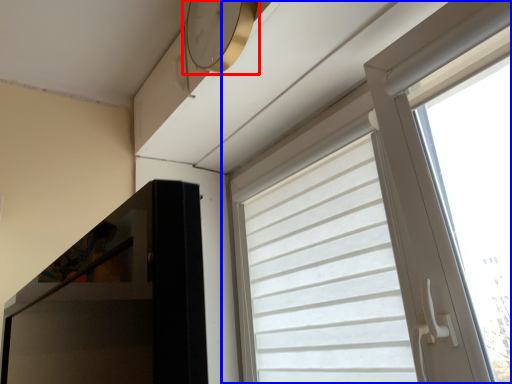
Question: Which object is further to the camera taking this photo, clock (highlighted by a red box) or window (highlighted by a blue box)?

Choices:
 (A) clock
 (B) window

Answer: (A)